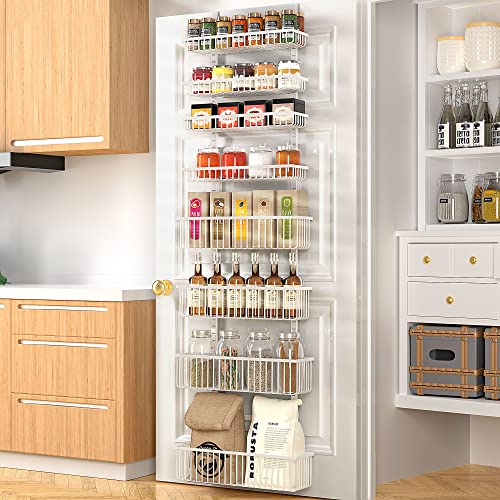
Locate an element on the screen. Image resolution: width=500 pixels, height=500 pixels. drawer pulls is located at coordinates (3, 306), (21, 306), (27, 342), (30, 399), (85, 138).